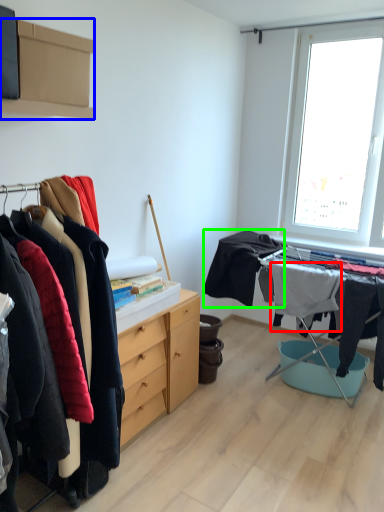
Question: Estimate the real-world distances between objects in this image. Which object is farther from clothing (highlighted by a red box), cabinetry (highlighted by a blue box) or clothing (highlighted by a green box)?

Choices:
 (A) cabinetry
 (B) clothing

Answer: (A)